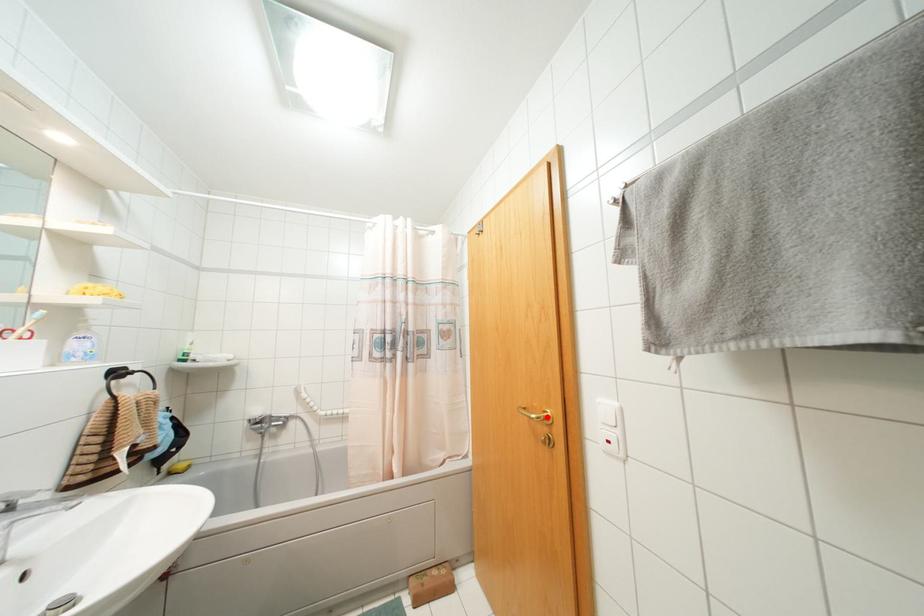
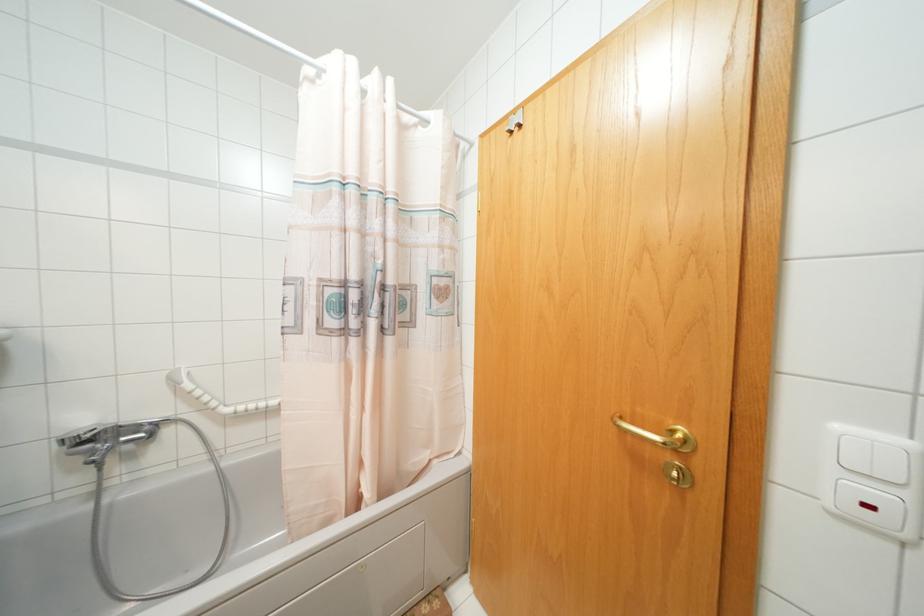
The point at the highlighted location is marked in the first image. Where is the corresponding point in the second image?

(686, 440)